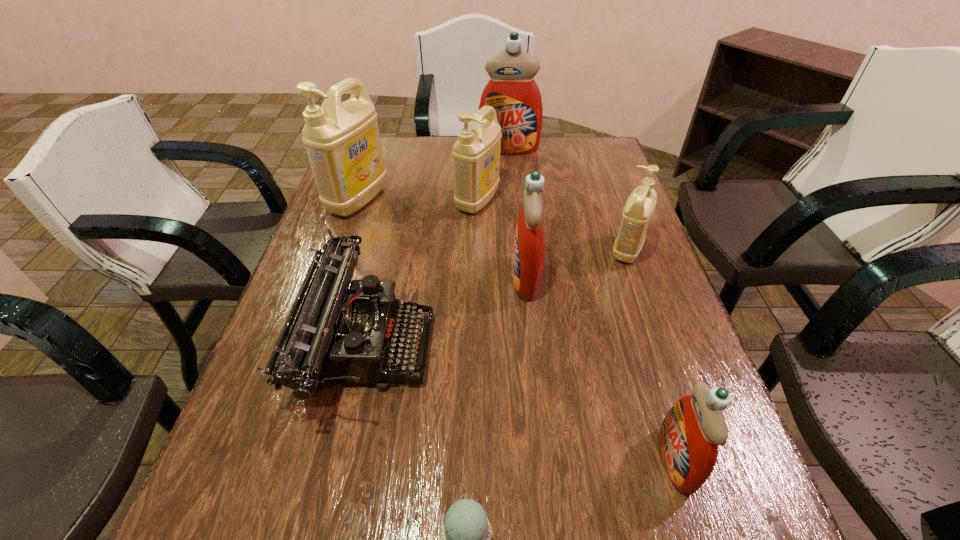
Find the location of `beige detergent that is the second nearest to the nearest beige detergent`. beige detergent that is the second nearest to the nearest beige detergent is located at coordinates (342, 140).

Identify which beige detergent is the second closest to the smallest red detergent. Please provide its 2D coordinates. Your answer should be formatted as a tuple, i.e. [(x, y)], where the tuple contains the x and y coordinates of a point satisfying the conditions above.

[(476, 155)]

Locate an element on the screen. This screenshot has width=960, height=540. red detergent that is the closest to the second beige detergent from right to left is located at coordinates (528, 247).

Where is `the third closest red detergent to the second biggest beige detergent`? the third closest red detergent to the second biggest beige detergent is located at coordinates (689, 435).

This screenshot has height=540, width=960. What are the coordinates of `free region that satisfies the following two spatial constraints: 1. on the front side of the second beige detergent from right to left; 2. on the keyboard of the typewriter` in the screenshot? It's located at (477, 343).